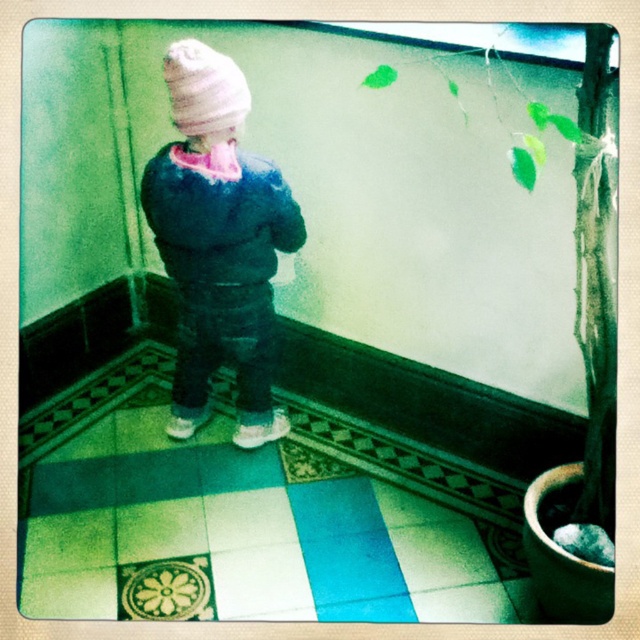
Question: Is fuzzy blue jacket at center smaller than white knit hat at upper center?

Choices:
 (A) no
 (B) yes

Answer: (A)

Question: Does fuzzy blue jacket at center appear on the right side of white knit hat at upper center?

Choices:
 (A) yes
 (B) no

Answer: (A)

Question: Which point is closer to the camera taking this photo?

Choices:
 (A) (193, 378)
 (B) (224, 74)

Answer: (B)

Question: Is fuzzy blue jacket at center smaller than white knit hat at upper center?

Choices:
 (A) no
 (B) yes

Answer: (A)

Question: Which object is farther from the camera taking this photo?

Choices:
 (A) fuzzy blue jacket at center
 (B) white knit hat at upper center

Answer: (A)

Question: Among these points, which one is nearest to the camera?

Choices:
 (A) (192, 60)
 (B) (220, 132)

Answer: (A)